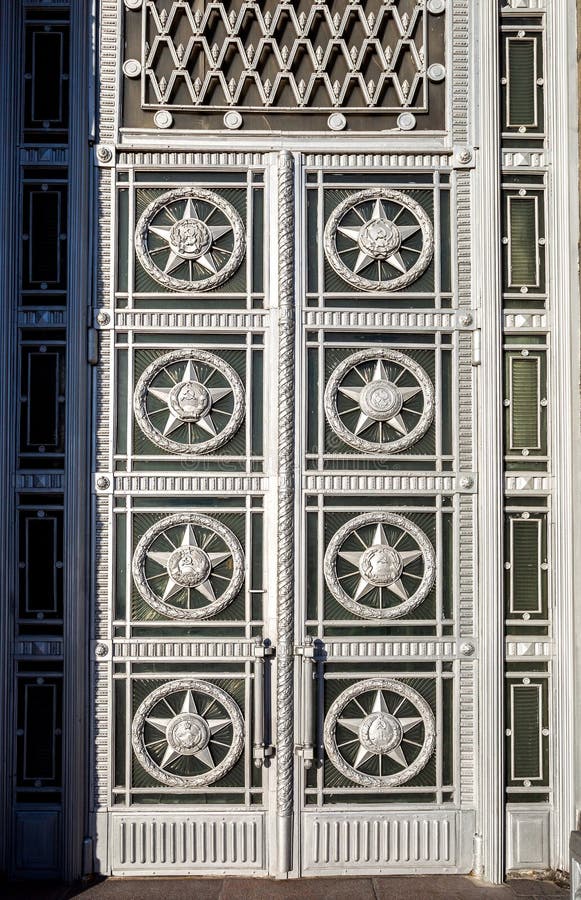
Where is `right door handle`? right door handle is located at coordinates (308, 698).